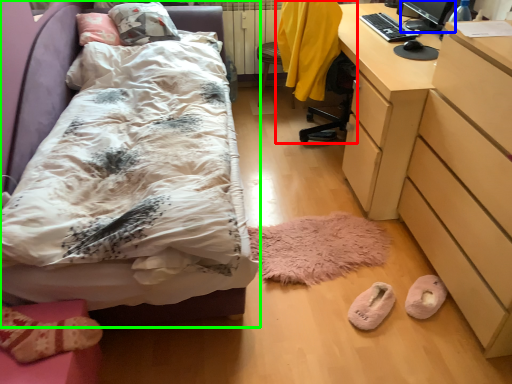
Question: Estimate the real-world distances between objects in this image. Which object is closer to swivel chair (highlighted by a red box), computer monitor (highlighted by a blue box) or bed (highlighted by a green box)?

Choices:
 (A) computer monitor
 (B) bed

Answer: (A)